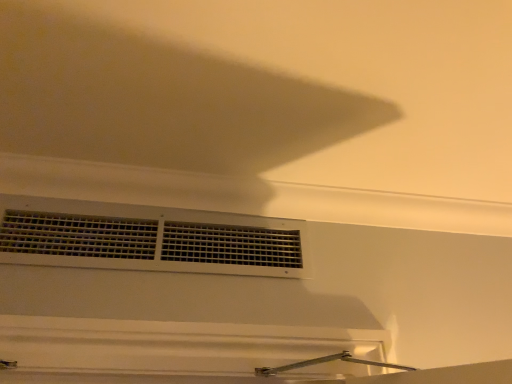
Question: Considering the positions of white matte vent at center and white matte exhaust hood at upper center in the image, is white matte vent at center taller or shorter than white matte exhaust hood at upper center?

Choices:
 (A) short
 (B) tall

Answer: (B)

Question: In terms of size, does white matte vent at center appear bigger or smaller than white matte exhaust hood at upper center?

Choices:
 (A) small
 (B) big

Answer: (A)

Question: In the image, is white matte vent at center on the left side or the right side of white matte exhaust hood at upper center?

Choices:
 (A) left
 (B) right

Answer: (A)

Question: Is white matte exhaust hood at upper center wider or thinner than white matte vent at center?

Choices:
 (A) wide
 (B) thin

Answer: (A)

Question: Relative to white matte vent at center, is white matte exhaust hood at upper center in front or behind?

Choices:
 (A) behind
 (B) front

Answer: (B)

Question: Would you say white matte exhaust hood at upper center is to the left or to the right of white matte vent at center in the picture?

Choices:
 (A) right
 (B) left

Answer: (A)

Question: From their relative heights in the image, would you say white matte exhaust hood at upper center is taller or shorter than white matte vent at center?

Choices:
 (A) short
 (B) tall

Answer: (A)